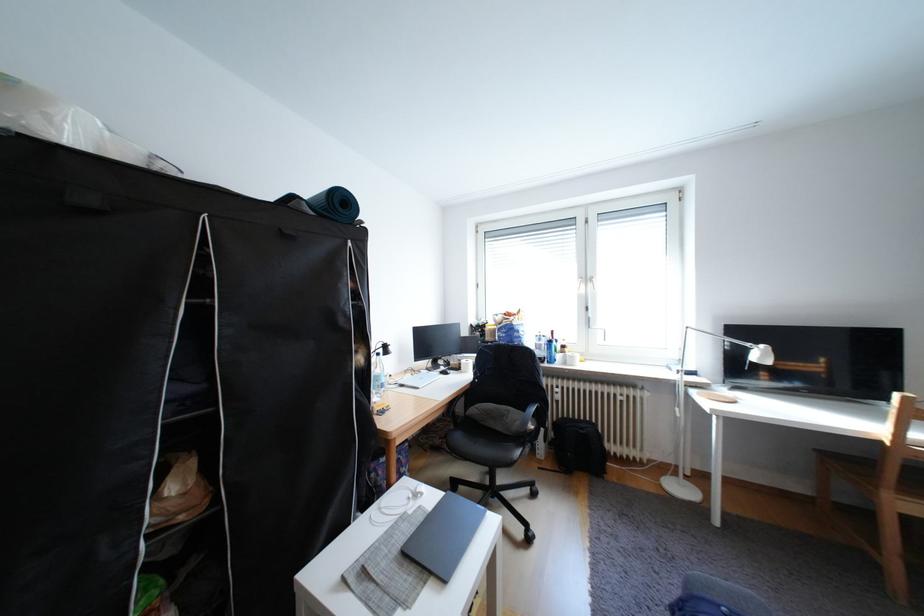
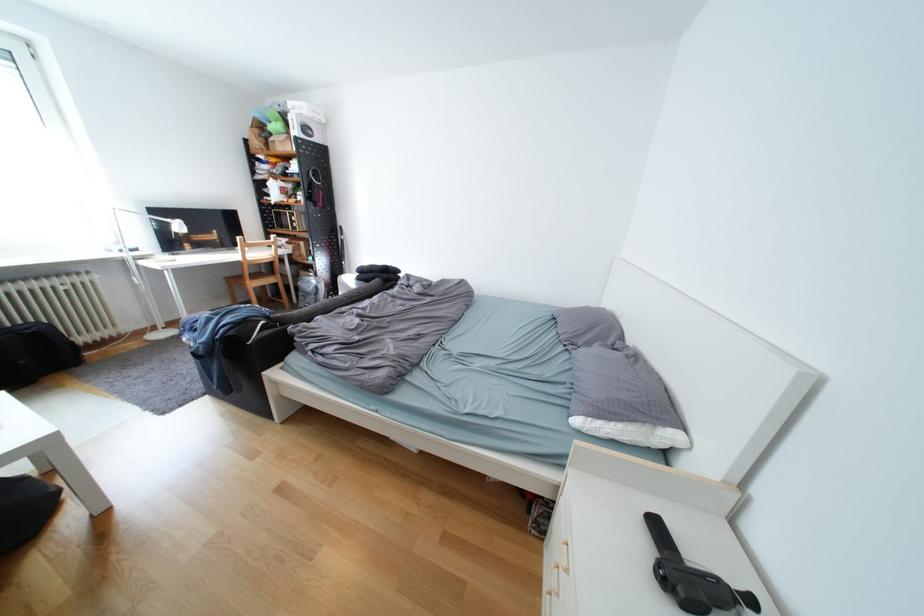
Locate, in the second image, the point that corresponds to (587,421) in the first image.

(14, 330)